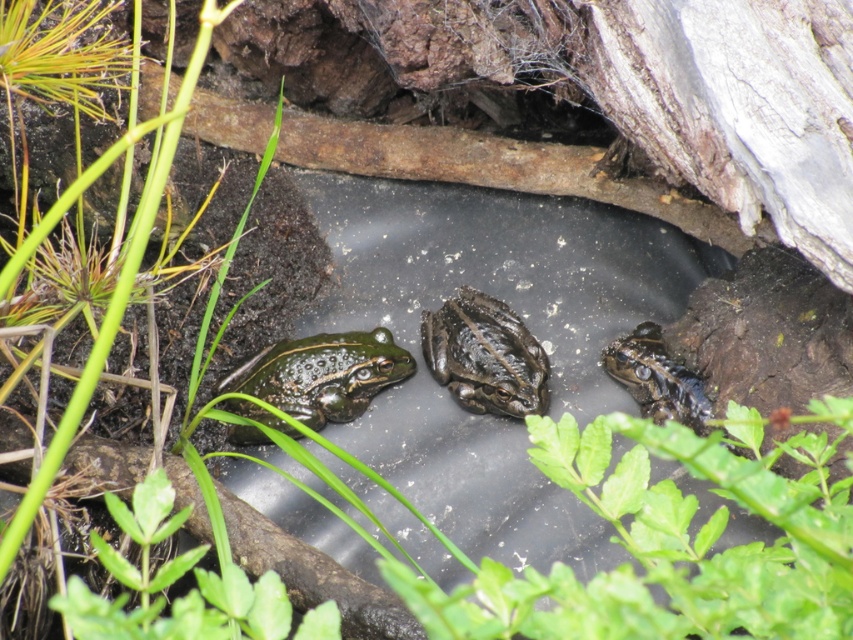
You are a wildlife photographer trying to capture a closeup shot of the green shiny skin at center and the green textured frog at center. Your camera has a maximum focus range of 8 inches. Can you focus on both subjects simultaneously?

The green shiny skin at center is 8.52 inches from the green textured frog at center. Since the distance between them exceeds the camera maximum focus range of 8 inches, you cannot focus on both subjects simultaneously.

In the scene, there are a green shiny skin at center and a shiny green frog at center. Which one has a greater width?

The green shiny skin at center has a greater width than the shiny green frog at center.